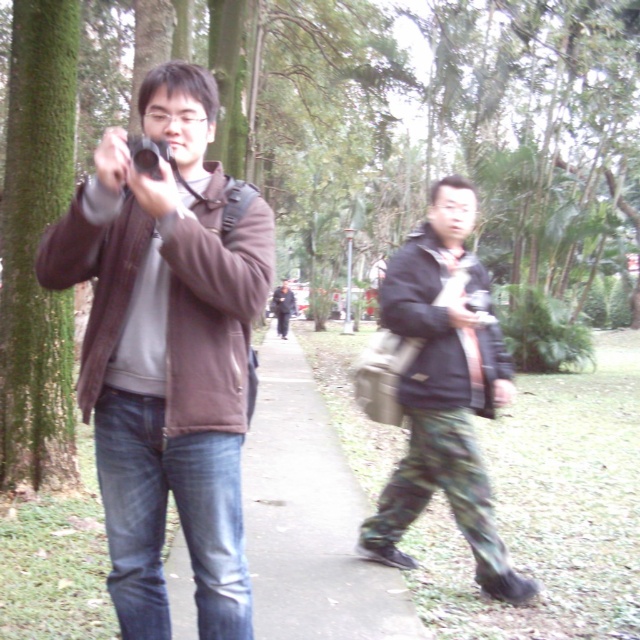
Which of these two, brown matte jacket at center or camouflage pants at center, stands taller?

Standing taller between the two is camouflage pants at center.

Image resolution: width=640 pixels, height=640 pixels. What do you see at coordinates (168, 353) in the screenshot?
I see `brown matte jacket at center` at bounding box center [168, 353].

Where is `brown matte jacket at center`? The height and width of the screenshot is (640, 640). brown matte jacket at center is located at coordinates (168, 353).

Is point (33, 96) positioned in front of point (282, 291)?

Yes, point (33, 96) is closer to viewer.

Is green rough bark tree at left below dark gray jacket at center?

Correct, green rough bark tree at left is located below dark gray jacket at center.

Who is more distant from viewer, (x=4, y=474) or (x=289, y=307)?

The point (x=289, y=307) is behind.

You are a GUI agent. You are given a task and a screenshot of the screen. Output one action in this format:
    pyautogui.click(x=<x>, y=<y>)
    Task: Click on the green rough bark tree at left
    Image resolution: width=640 pixels, height=640 pixels.
    Given the screenshot: What is the action you would take?
    pyautogui.click(x=35, y=250)

Is point (396, 412) more distant than point (42, 413)?

No, it is in front of (42, 413).

Between camouflage pants at center and green rough bark tree at left, which one appears on the right side from the viewer's perspective?

camouflage pants at center

Does point (429, 438) come behind point (29, 337)?

No, (429, 438) is in front of (29, 337).

Image resolution: width=640 pixels, height=640 pixels. I want to click on camouflage pants at center, so click(x=438, y=388).